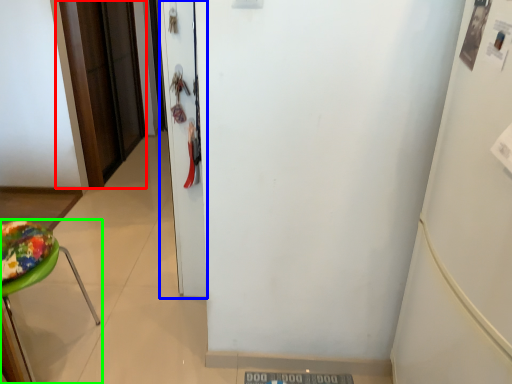
Question: Estimate the real-world distances between objects in this image. Which object is farther from door (highlighted by a red box), door (highlighted by a blue box) or furniture (highlighted by a green box)?

Choices:
 (A) door
 (B) furniture

Answer: (B)